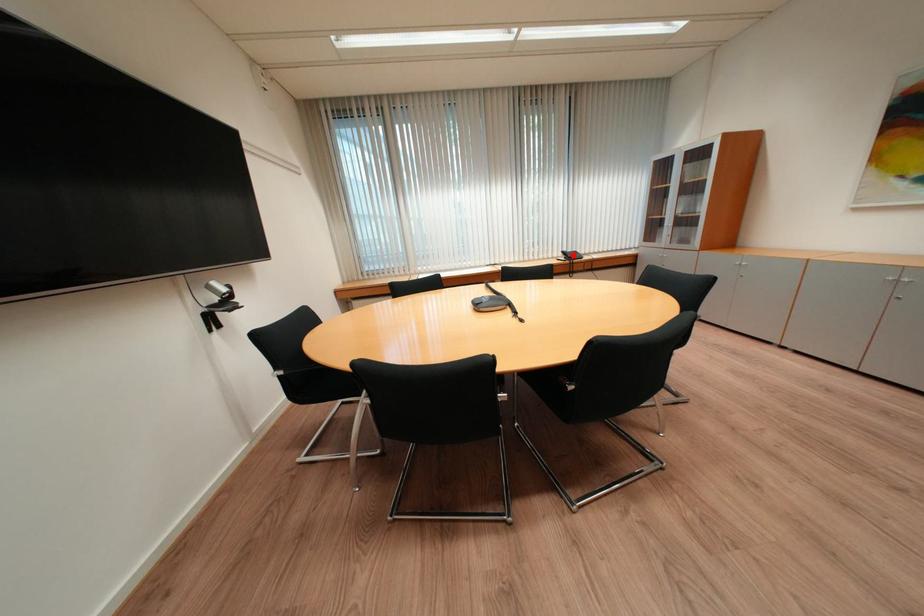
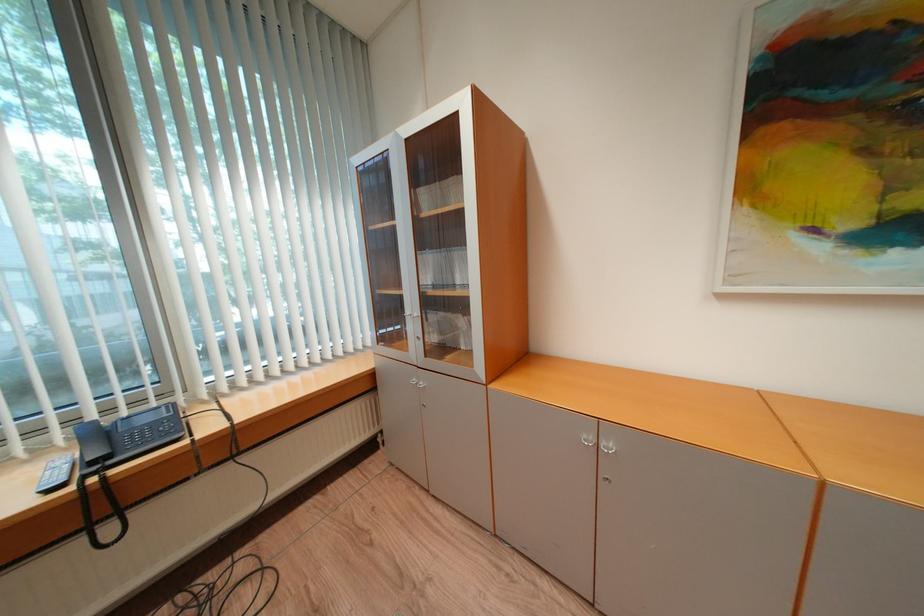
Where in the second image is the point corresponding to the highlighted location from the first image?

(104, 434)